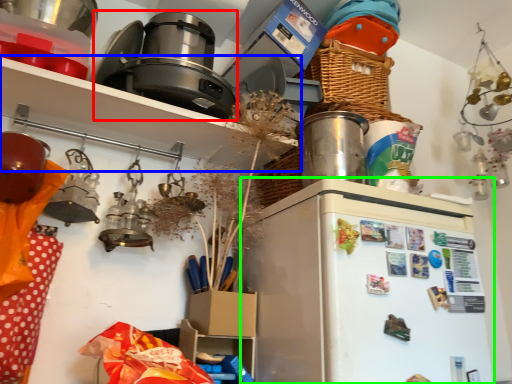
Question: Which object is positioned farthest from appliance (highlighted by a red box)? Select from shelf (highlighted by a blue box) and fridge (highlighted by a green box).

Choices:
 (A) shelf
 (B) fridge

Answer: (B)